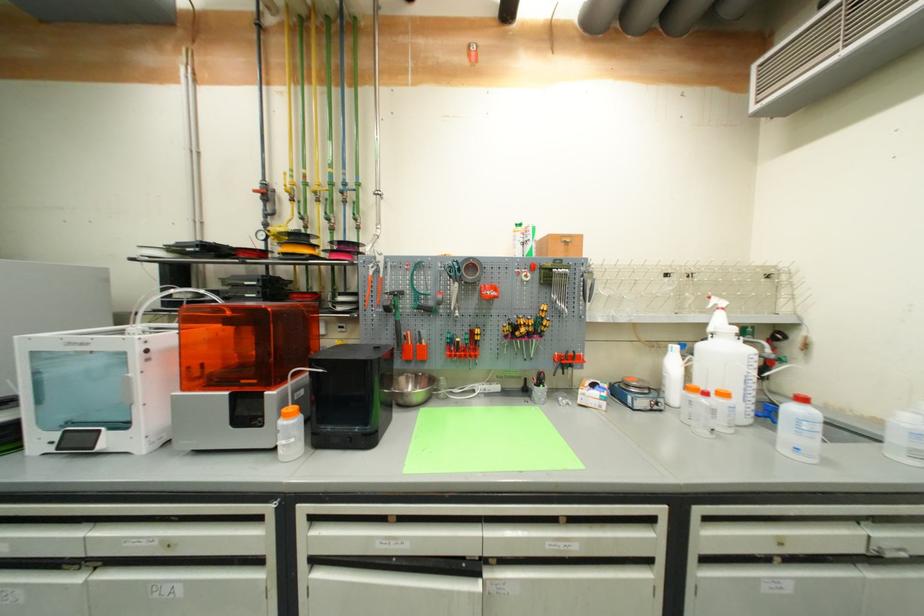
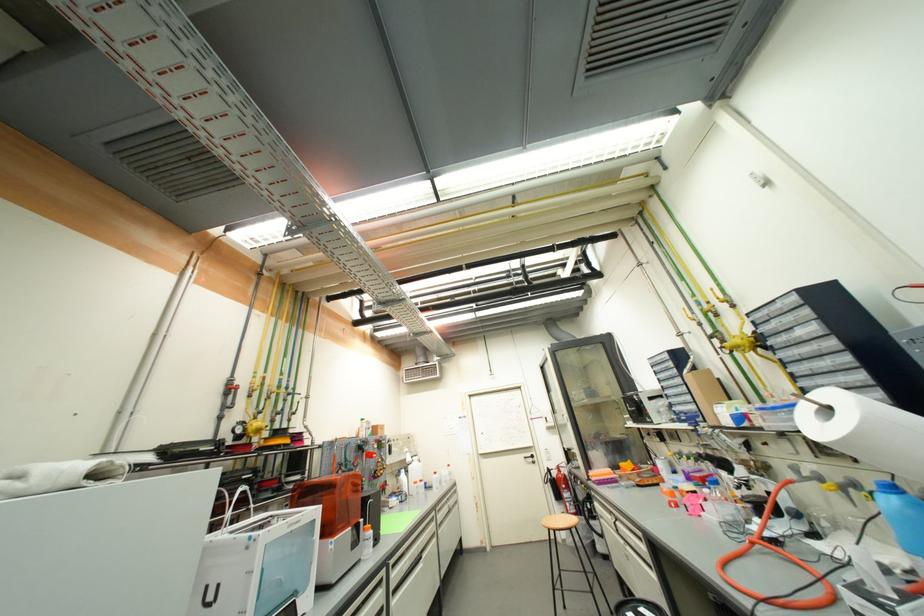
Find the pixel in the second image that matches point (711, 326) in the first image.

(410, 461)